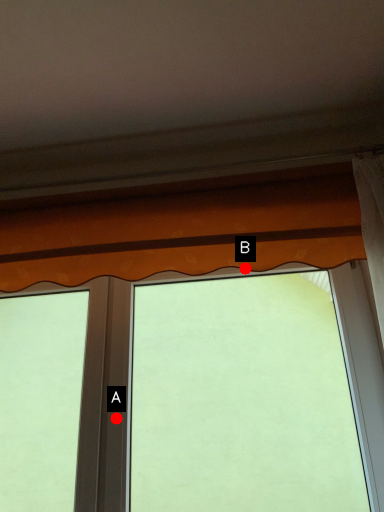
Question: Two points are circled on the image, labeled by A and B beside each circle. Which point appears farthest from the camera in this image?

Choices:
 (A) A is further
 (B) B is further

Answer: (A)